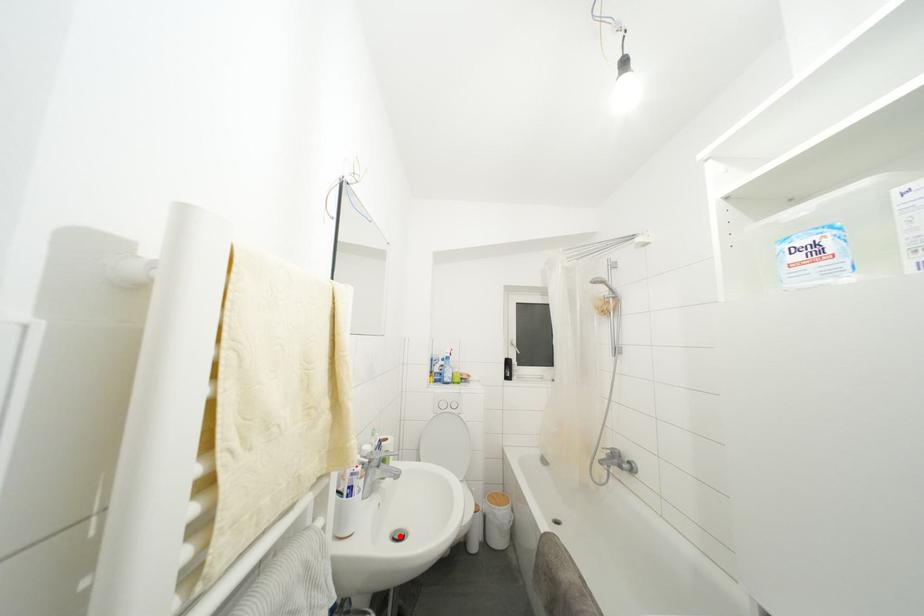
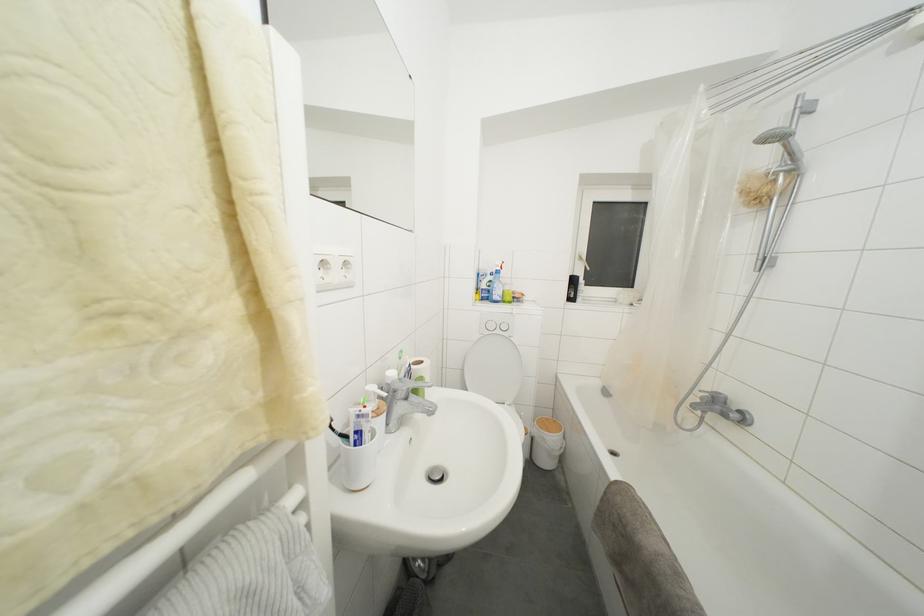
In the second image, find the point that corresponds to the highlighted location in the first image.

(436, 475)